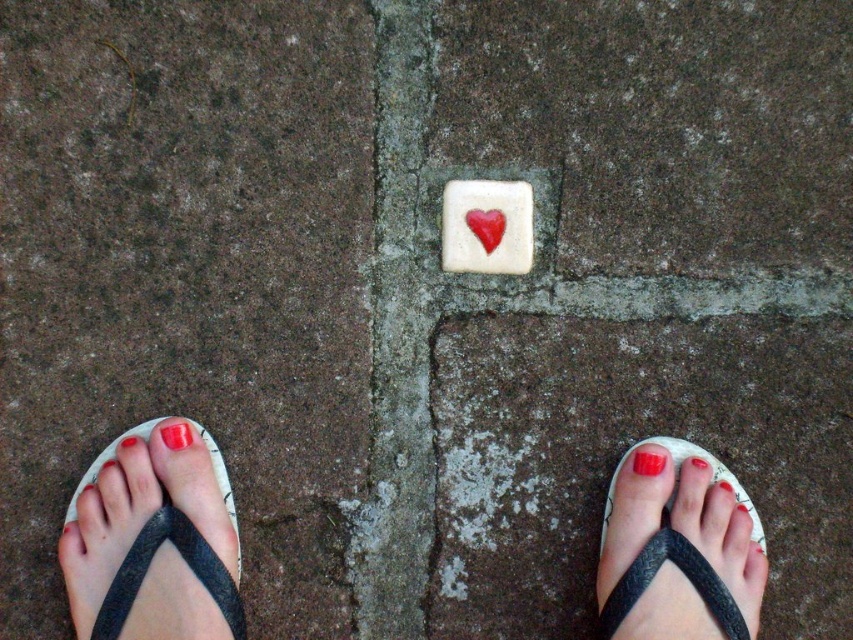
Which is above, matte black flip-flop at lower left or black rubber sandal at lower right?

matte black flip-flop at lower left

Who is more forward, (144, 625) or (640, 596)?

Point (144, 625) is in front.

Is point (155, 540) positioned before point (677, 570)?

That is True.

This screenshot has height=640, width=853. In order to click on matte black flip-flop at lower left in this screenshot , I will do `click(152, 545)`.

Between white matte tile with red heart at center and glossy red nail at center, which one has less height?

glossy red nail at center is shorter.

Does point (461, 241) come behind point (663, 456)?

Yes, point (461, 241) is behind point (663, 456).

Where is `white matte tile with red heart at center`? white matte tile with red heart at center is located at coordinates (486, 227).

In the scene shown: Is black rubber sandal at lower right behind white matte tile with red heart at center?

That is False.

I want to click on black rubber sandal at lower right, so click(679, 552).